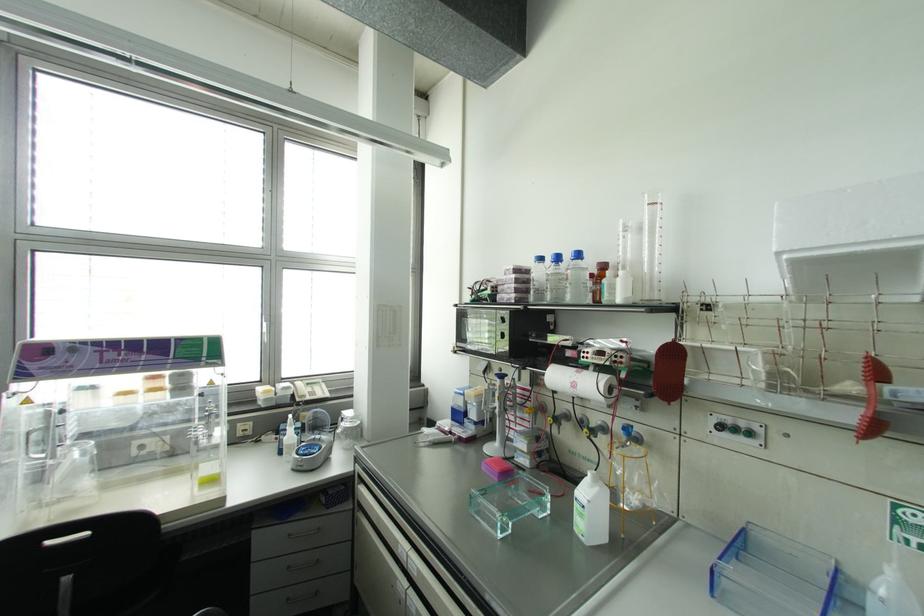
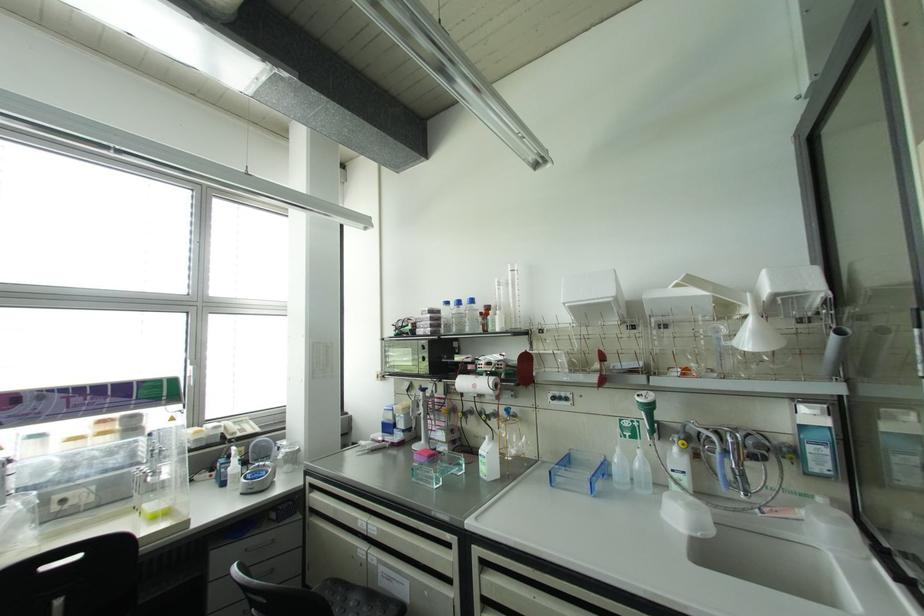
The point at (457, 415) is marked in the first image. Where is the corresponding point in the second image?

(387, 427)